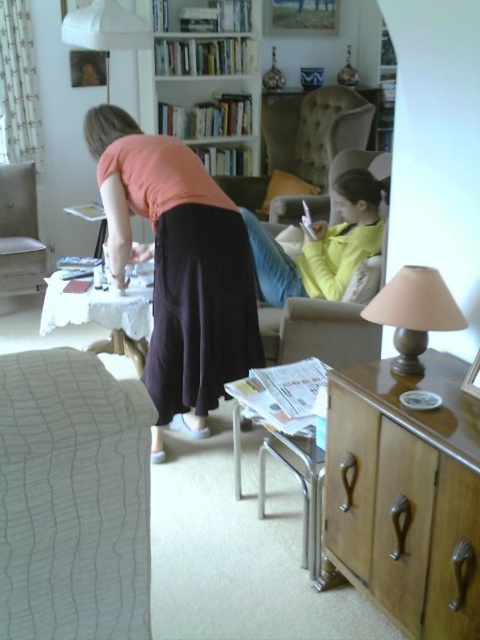
Question: Can you confirm if white textured fabric at lower left is positioned to the right of matte pink shirt at center?

Choices:
 (A) no
 (B) yes

Answer: (B)

Question: Which point appears farthest from the camera in this image?

Choices:
 (A) (182, 3)
 (B) (429, 285)
 (C) (290, 147)
 (D) (72, 20)

Answer: (C)

Question: Can you confirm if matte pink shirt at center is smaller than light brown leather armchair at center?

Choices:
 (A) yes
 (B) no

Answer: (A)

Question: Based on their relative distances, which object is nearer to the white matte lampshade at upper center?

Choices:
 (A) beige fabric lampshade at right
 (B) white textured fabric at lower left

Answer: (A)

Question: Which object is the farthest from the light brown fabric armchair at left?

Choices:
 (A) wooden cabinet at right
 (B) white matte lampshade at upper center
 (C) white textured fabric at lower left
 (D) light yellow sweater at center

Answer: (C)

Question: Does light yellow sweater at center have a larger size compared to light brown leather armchair at center?

Choices:
 (A) no
 (B) yes

Answer: (A)